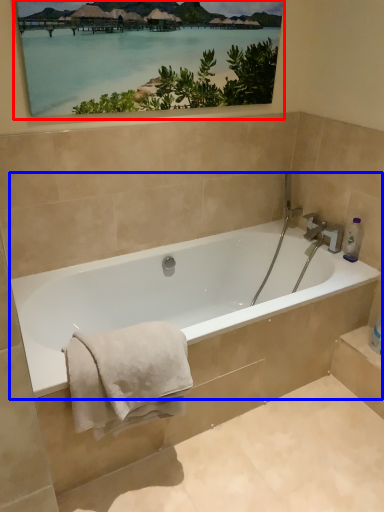
Question: Among these objects, which one is nearest to the camera, picture frame (highlighted by a red box) or bathtub (highlighted by a blue box)?

Choices:
 (A) picture frame
 (B) bathtub

Answer: (B)